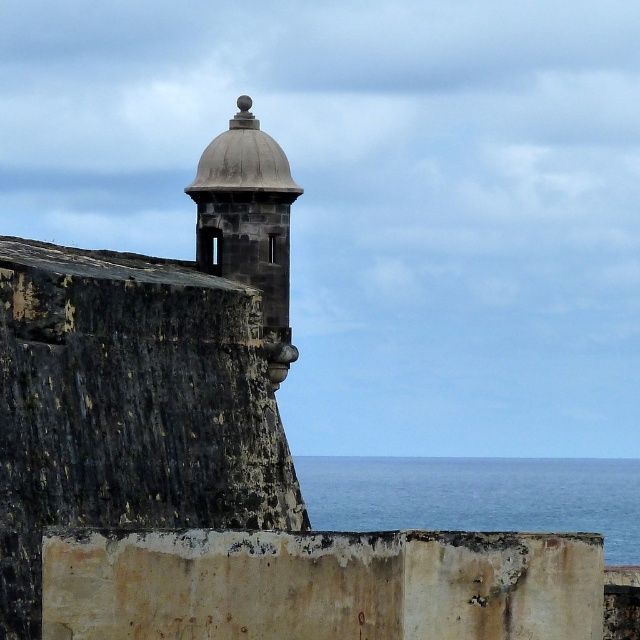
Question: Which point is closer to the camera taking this photo?

Choices:
 (A) (241, 97)
 (B) (564, 500)

Answer: (A)

Question: Which point is farther to the camera?

Choices:
 (A) (499, 515)
 (B) (202, 230)

Answer: (A)

Question: Is blue water at center closer to the viewer compared to smooth stone tower at upper center?

Choices:
 (A) no
 (B) yes

Answer: (B)

Question: Can you confirm if blue water at center is smaller than smooth stone tower at upper center?

Choices:
 (A) no
 (B) yes

Answer: (A)

Question: Does blue water at center have a lesser width compared to smooth stone tower at upper center?

Choices:
 (A) no
 (B) yes

Answer: (A)